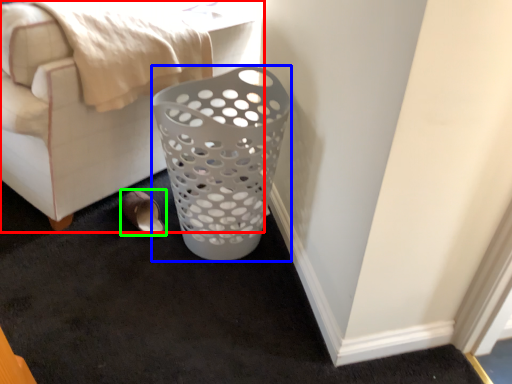
Question: Estimate the real-world distances between objects in this image. Which object is farther from furniture (highlighted by a red box), basket (highlighted by a blue box) or footwear (highlighted by a green box)?

Choices:
 (A) basket
 (B) footwear

Answer: (A)